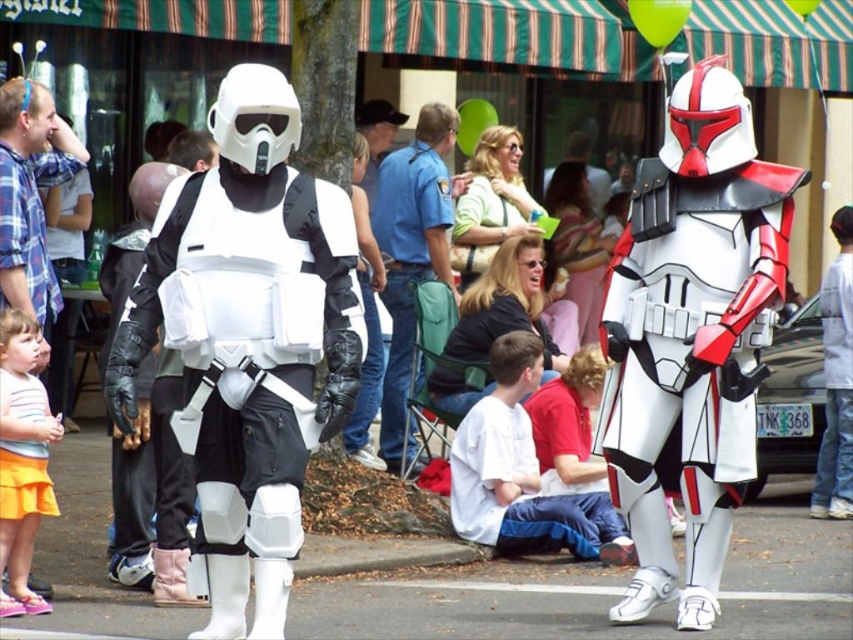
Question: In this image, where is white matte armor at center located relative to white matte/soft fabric at center?

Choices:
 (A) right
 (B) left

Answer: (A)

Question: Does white matte armor at center appear on the right side of blue uniform shirt at center?

Choices:
 (A) yes
 (B) no

Answer: (A)

Question: Based on their relative distances, which object is farther from the white matte/soft fabric at center?

Choices:
 (A) white matte armor at center
 (B) white matte/soft plastic stormtrooper at center
 (C) striped shirt and orange skirt at lower left
 (D) blue uniform shirt at center

Answer: (C)

Question: Which is nearer to the striped shirt and orange skirt at lower left?

Choices:
 (A) blue uniform shirt at center
 (B) white matte/soft plastic stormtrooper at center
 (C) white matte armor at center

Answer: (B)

Question: Can you confirm if white matte/soft fabric at center is bigger than blue uniform shirt at center?

Choices:
 (A) no
 (B) yes

Answer: (A)

Question: Estimate the real-world distances between objects in this image. Which object is farther from the white matte/soft fabric at center?

Choices:
 (A) striped shirt and orange skirt at lower left
 (B) blue uniform shirt at center
 (C) white matte armor at center

Answer: (A)